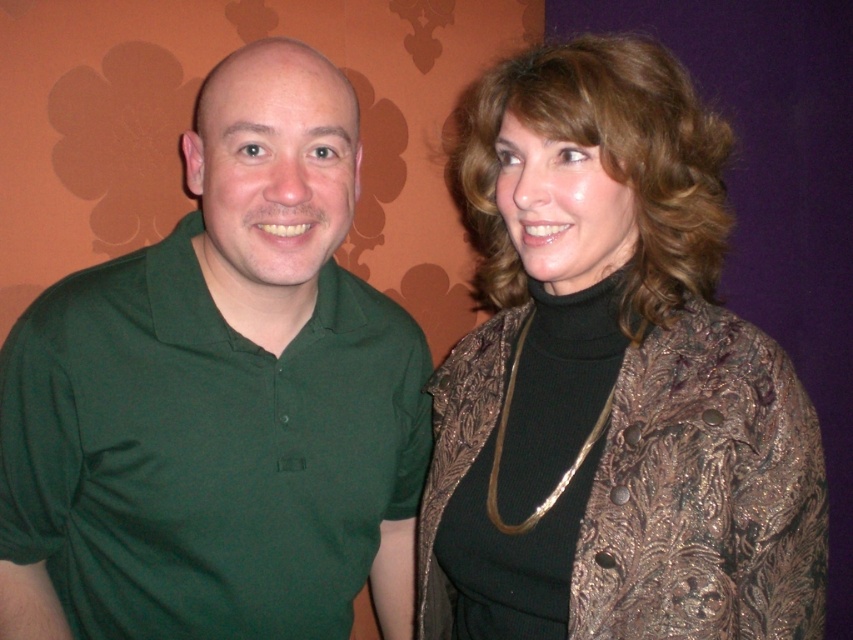
Question: Which point appears farthest from the camera in this image?

Choices:
 (A) (427, 480)
 (B) (236, 113)

Answer: (A)

Question: Is shiny bronze jacket at center further to camera compared to green matte shirt at left?

Choices:
 (A) no
 (B) yes

Answer: (A)

Question: Which of the following is the farthest from the observer?

Choices:
 (A) shiny bronze jacket at center
 (B) green matte shirt at left

Answer: (B)

Question: Considering the relative positions of shiny bronze jacket at center and green matte shirt at left in the image provided, where is shiny bronze jacket at center located with respect to green matte shirt at left?

Choices:
 (A) below
 (B) above

Answer: (B)

Question: Does shiny bronze jacket at center have a smaller size compared to green matte shirt at left?

Choices:
 (A) no
 (B) yes

Answer: (B)